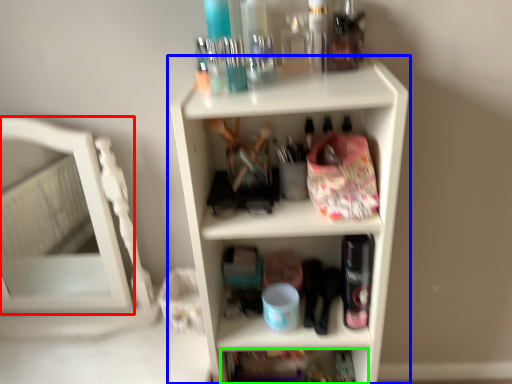
Question: Based on their relative distances, which object is nearer to mirror (highlighted by a red box)? Choose from shelf (highlighted by a blue box) and shelf (highlighted by a green box).

Choices:
 (A) shelf
 (B) shelf

Answer: (A)